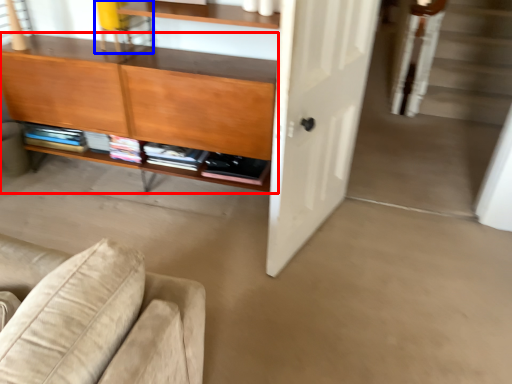
Question: Which object is further to the camera taking this photo, cabinetry (highlighted by a red box) or chair (highlighted by a blue box)?

Choices:
 (A) cabinetry
 (B) chair

Answer: (B)